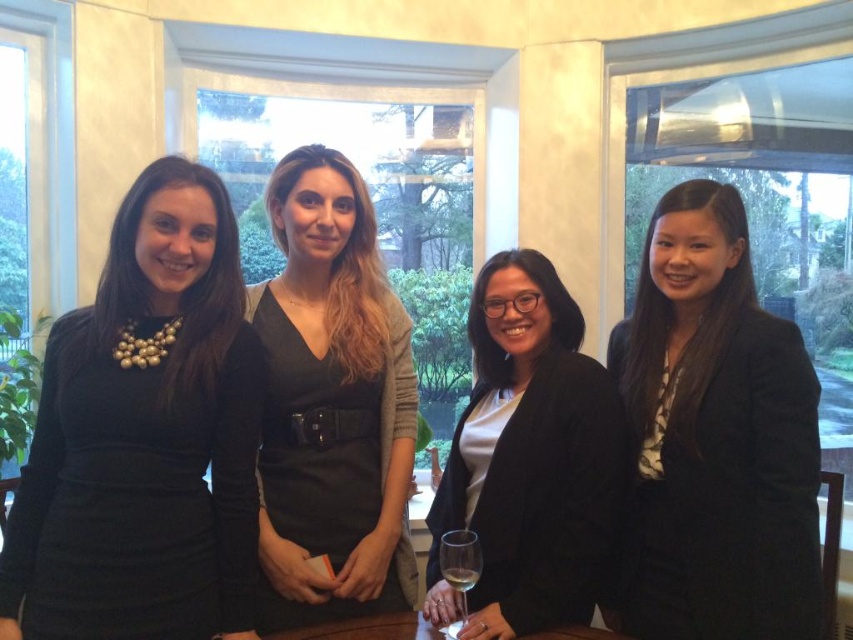
Question: Which object appears closest to the camera in this image?

Choices:
 (A) black matte blazer at right
 (B) wooden table at center
 (C) black matte dress at center
 (D) black matte blazer at center

Answer: (A)

Question: Is black matte blazer at right further to the viewer compared to clear glass wine glass at center?

Choices:
 (A) yes
 (B) no

Answer: (A)

Question: Among these objects, which one is nearest to the camera?

Choices:
 (A) black matte dress at left
 (B) black matte blazer at right
 (C) clear glass at center
 (D) wooden table at center

Answer: (A)

Question: Does wooden table at center appear on the right side of clear glass wine glass at center?

Choices:
 (A) no
 (B) yes

Answer: (A)

Question: Estimate the real-world distances between objects in this image. Which object is closer to the black matte dress at center?

Choices:
 (A) black matte dress at left
 (B) black matte blazer at right
 (C) black matte blazer at center

Answer: (A)

Question: Is black matte blazer at right thinner than clear glass at center?

Choices:
 (A) no
 (B) yes

Answer: (A)